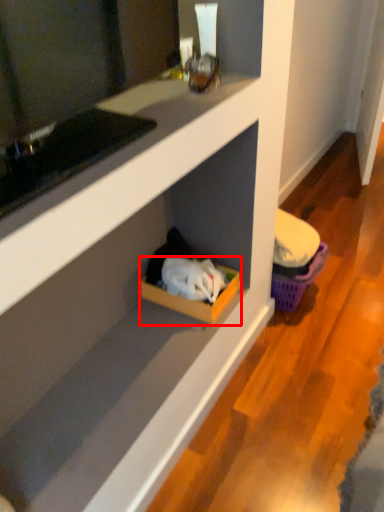
Question: From the image's perspective, where is storage box (annotated by the red box) located in relation to basket in the image?

Choices:
 (A) below
 (B) above

Answer: (A)